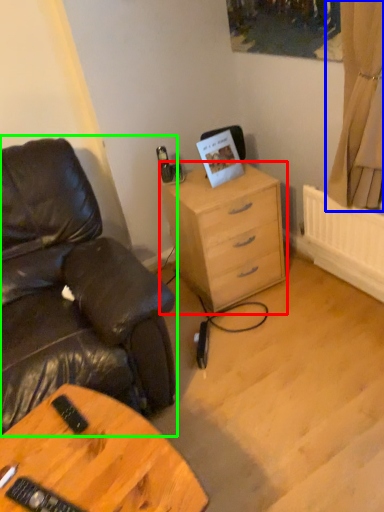
Question: Which object is the closest to the chest of drawers (highlighted by a red box)? Choose among these: curtain (highlighted by a blue box) or chair (highlighted by a green box).

Choices:
 (A) curtain
 (B) chair

Answer: (A)